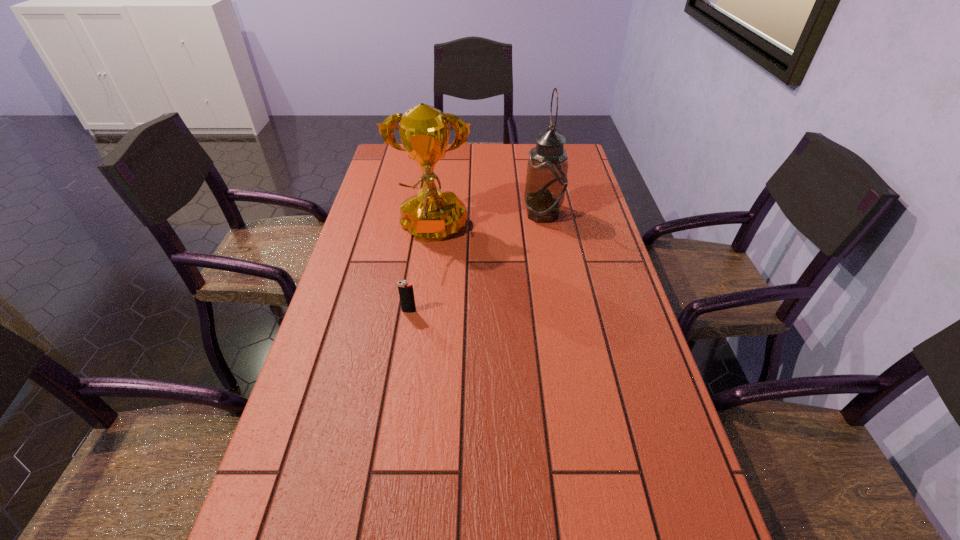
In the image, there is a desktop. Identify the location of vacant space at the left edge. This screenshot has width=960, height=540. (393, 262).

The image size is (960, 540). Find the location of `vacant area at the right edge`. vacant area at the right edge is located at coordinates (589, 322).

Find the location of a particular element. Image resolution: width=960 pixels, height=540 pixels. vacant position at the far left corner of the desktop is located at coordinates click(x=417, y=168).

Identify the location of free space that is in between the award and the igniter. The height and width of the screenshot is (540, 960). (420, 272).

The height and width of the screenshot is (540, 960). I want to click on free space between the shortest object and the award, so click(x=420, y=272).

Locate an element on the screen. Image resolution: width=960 pixels, height=540 pixels. free space between the award and the igniter is located at coordinates (420, 272).

Find the location of a particular element. This screenshot has width=960, height=540. blank region between the igniter and the award is located at coordinates (420, 272).

Identify the location of unoccupied position between the igniter and the oil lamp. (476, 262).

This screenshot has width=960, height=540. In order to click on object that stands as the second closest to the oil lamp in this screenshot , I will do `click(406, 293)`.

Identify the location of the second closest object relative to the nearest object. (546, 181).